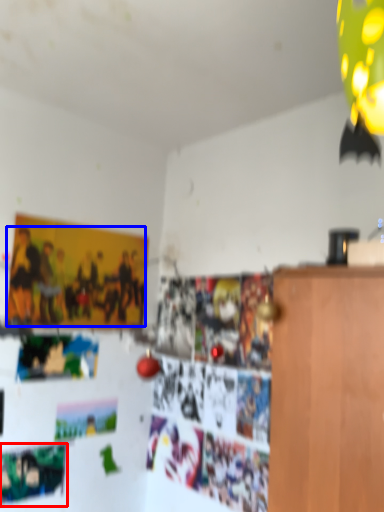
Question: Which object is closer to the camera taking this photo, poster (highlighted by a red box) or person (highlighted by a blue box)?

Choices:
 (A) poster
 (B) person

Answer: (A)